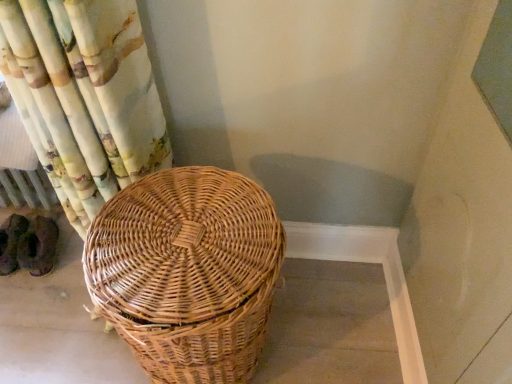
Locate an element on the screen. vacant region to the left of woven brown picnic basket at center is located at coordinates (67, 339).